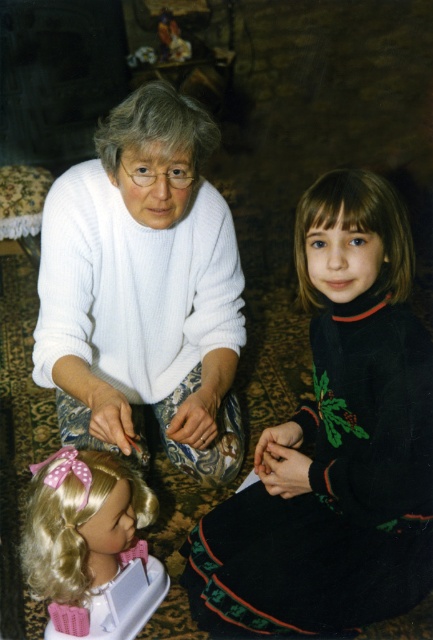
Does white knitted sweater at center have a lesser height compared to gray matte hair at upper center?

No, white knitted sweater at center is not shorter than gray matte hair at upper center.

Is white knitted sweater at center above gray matte hair at upper center?

Actually, white knitted sweater at center is below gray matte hair at upper center.

What are the coordinates of `white knitted sweater at center` in the screenshot? It's located at (144, 289).

Is white knitted sweater at center to the left of blonde hair wig at lower left from the viewer's perspective?

No, white knitted sweater at center is not to the left of blonde hair wig at lower left.

Is point (120, 332) behind point (29, 545)?

Yes, point (120, 332) is behind point (29, 545).

Locate an element on the screen. This screenshot has width=433, height=640. white knitted sweater at center is located at coordinates (144, 289).

Can you confirm if black matte dress at lower right is shorter than white knitted sweater at center?

Yes.

Who is higher up, black matte dress at lower right or white knitted sweater at center?

white knitted sweater at center

Does point (299, 586) come farther from viewer compared to point (78, 376)?

No, (299, 586) is in front of (78, 376).

Find the location of a particular element. This screenshot has width=433, height=640. black matte dress at lower right is located at coordinates (335, 444).